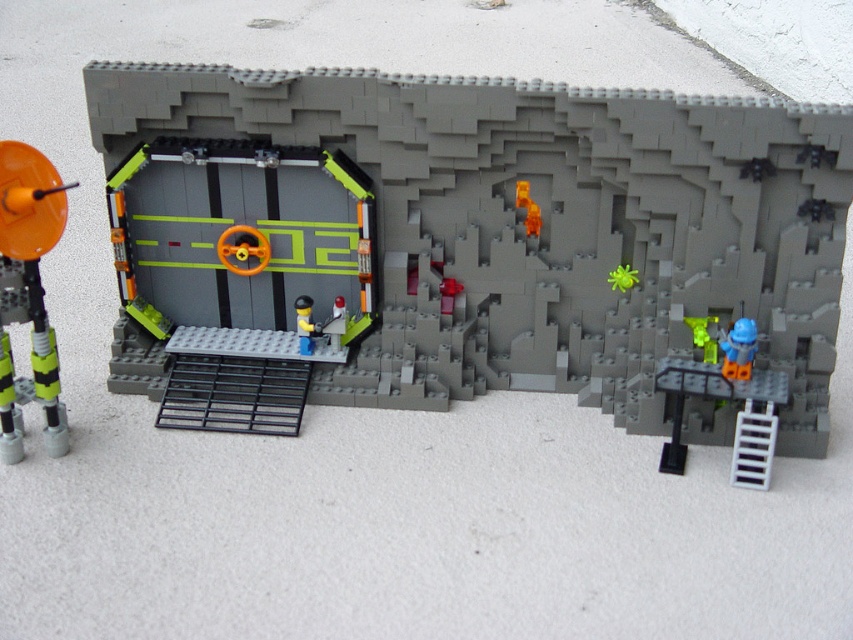
Can you confirm if orange matte/soft plastic antenna at left is positioned below light blue plastic figure at center?

Actually, orange matte/soft plastic antenna at left is above light blue plastic figure at center.

What do you see at coordinates (28, 292) in the screenshot?
I see `orange matte/soft plastic antenna at left` at bounding box center [28, 292].

The image size is (853, 640). Find the location of `orange matte/soft plastic antenna at left`. orange matte/soft plastic antenna at left is located at coordinates (28, 292).

Can you confirm if matte gray wall at center is smaller than orange matte/soft plastic antenna at left?

Incorrect, matte gray wall at center is not smaller in size than orange matte/soft plastic antenna at left.

Is point (399, 243) more distant than point (59, 435)?

Yes, point (399, 243) is farther from viewer.

The height and width of the screenshot is (640, 853). What are the coordinates of `matte gray wall at center` in the screenshot? It's located at coord(488,227).

From the picture: Who is lower down, green matte figure at center or smooth plastic figure at center?

Positioned lower is green matte figure at center.

Does green matte figure at center have a lesser height compared to smooth plastic figure at center?

Indeed, green matte figure at center has a lesser height compared to smooth plastic figure at center.

At what (x,y) coordinates should I click in order to perform the action: click on green matte figure at center. Please return your answer as a coordinate pair (x, y). The width and height of the screenshot is (853, 640). Looking at the image, I should click on (703, 336).